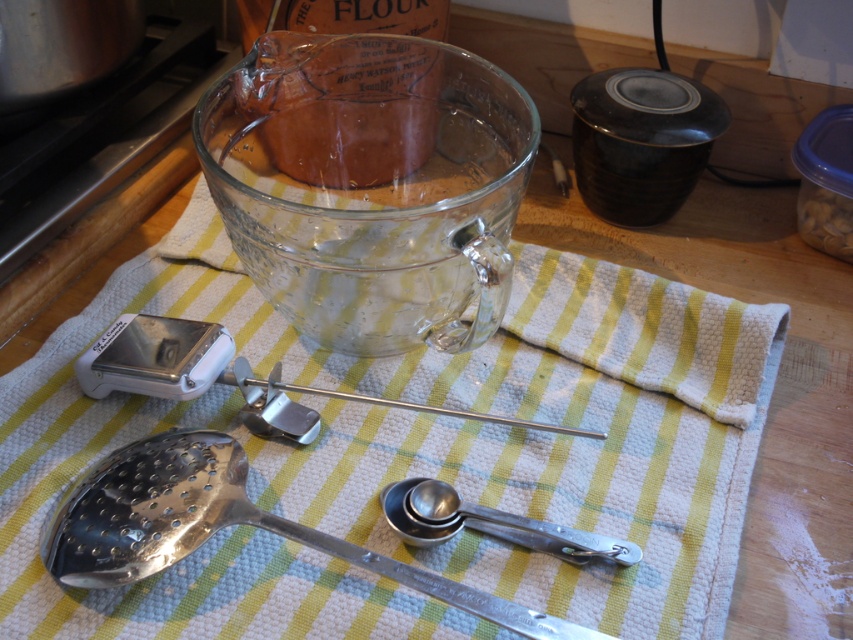
Question: Estimate the real-world distances between objects in this image. Which object is closer to the white woven cloth at center?

Choices:
 (A) polished metal slotted spoon at lower left
 (B) silver metallic measuring spoons at center

Answer: (A)

Question: Can you confirm if white woven cloth at center is wider than silver metallic measuring spoons at center?

Choices:
 (A) no
 (B) yes

Answer: (B)

Question: Which point is closer to the camera?

Choices:
 (A) (412, 515)
 (B) (225, 570)
 (C) (51, 573)

Answer: (C)

Question: Is polished metal slotted spoon at lower left wider than silver metallic measuring spoons at center?

Choices:
 (A) yes
 (B) no

Answer: (A)

Question: Which point is farther to the camera?

Choices:
 (A) silver metallic measuring spoons at center
 (B) white woven cloth at center
 (C) polished metal slotted spoon at lower left

Answer: (A)

Question: Considering the relative positions of polished metal slotted spoon at lower left and silver metallic measuring spoons at center in the image provided, where is polished metal slotted spoon at lower left located with respect to silver metallic measuring spoons at center?

Choices:
 (A) left
 (B) right

Answer: (A)